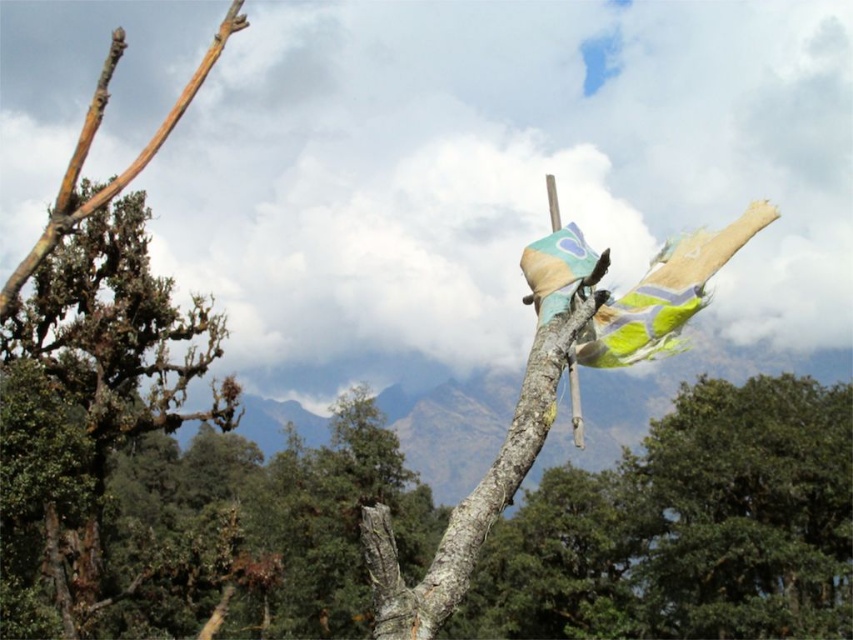
Question: Which of the following is the closest to the observer?

Choices:
 (A) (120, 424)
 (B) (759, 579)

Answer: (A)

Question: Among these objects, which one is farthest from the camera?

Choices:
 (A) brown rough bark at left
 (B) green leafy tree at lower right

Answer: (B)

Question: Is green leafy tree at lower right smaller than brown rough bark at left?

Choices:
 (A) yes
 (B) no

Answer: (B)

Question: Observing the image, what is the correct spatial positioning of green leafy tree at lower right in reference to brown rough bark at left?

Choices:
 (A) left
 (B) right

Answer: (B)

Question: Among these objects, which one is nearest to the camera?

Choices:
 (A) green leafy tree at lower right
 (B) brown rough bark at left

Answer: (B)

Question: Is green leafy tree at lower right further to the viewer compared to brown rough bark at left?

Choices:
 (A) yes
 (B) no

Answer: (A)